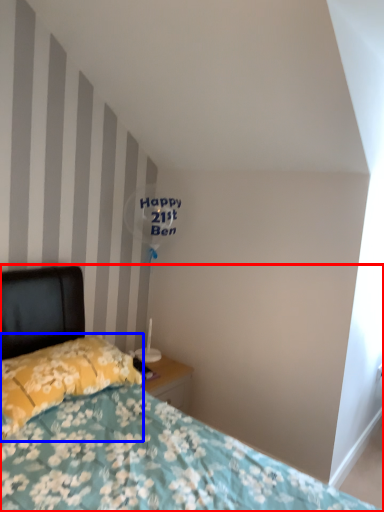
Question: Among these objects, which one is nearest to the camera, bed (highlighted by a red box) or pillow (highlighted by a blue box)?

Choices:
 (A) bed
 (B) pillow

Answer: (A)